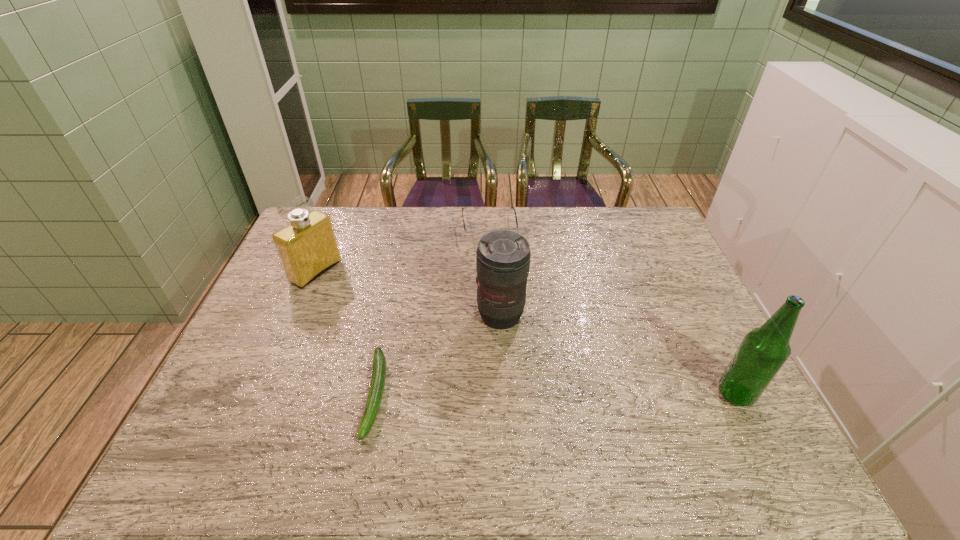
Locate an element on the screen. Image resolution: width=960 pixels, height=540 pixels. vacant spot on the desktop that is between the shortest object and the rightmost object and is positioned on the front-facing side of the leftmost object is located at coordinates (545, 394).

Image resolution: width=960 pixels, height=540 pixels. Identify the location of free spot on the desktop that is between the zucchini and the rightmost object and is positioned on the side of the third nearest object where the control switches are located. (536, 394).

Locate an element on the screen. free space on the desktop that is between the zucchini and the tallest object and is positioned on the front-facing side of the fourth tallest object is located at coordinates click(515, 394).